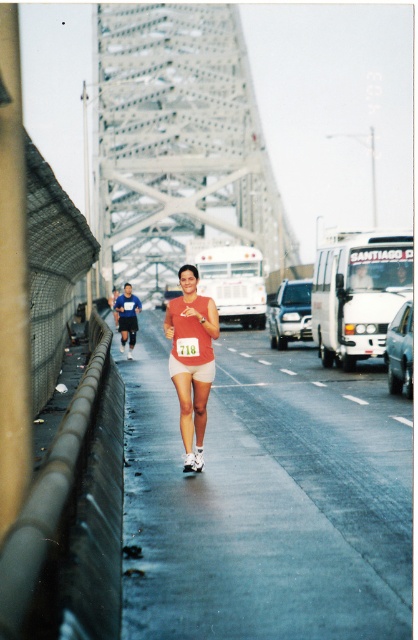
Question: Can you confirm if gray metallic bridge at center is wider than matte orange tank top at center?

Choices:
 (A) yes
 (B) no

Answer: (A)

Question: Does gray metallic bridge at center come behind matte orange tank top at center?

Choices:
 (A) yes
 (B) no

Answer: (A)

Question: Among these points, which one is farthest from the camera?

Choices:
 (A) (196, 301)
 (B) (155, 198)

Answer: (B)

Question: Is gray metallic bridge at center bigger than matte orange tank top at center?

Choices:
 (A) yes
 (B) no

Answer: (A)